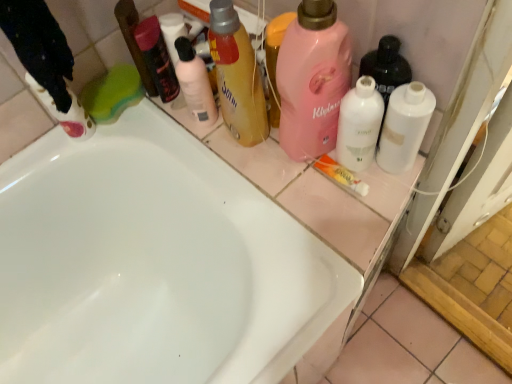
What is the approximate width of translucent yellow bottle at upper center, positioned as the fourth cleaning product in right-to-left order?

translucent yellow bottle at upper center, positioned as the fourth cleaning product in right-to-left order, is 2.25 inches in width.

Describe the element at coordinates (64, 113) in the screenshot. I see `matte white cleaning product at left, placed as the 7th cleaning product when sorted from right to left` at that location.

Where is `matte white cleaning product at left, placed as the 7th cleaning product when sorted from right to left`? The height and width of the screenshot is (384, 512). matte white cleaning product at left, placed as the 7th cleaning product when sorted from right to left is located at coordinates (64, 113).

Describe the element at coordinates (157, 58) in the screenshot. I see `matte black mouthwash at upper center` at that location.

I want to click on white glossy bathtub at center, so click(154, 264).

From the image's perspective, would you say white matte bottle at right, acting as the seventh cleaning product starting from the left, is positioned over matte pink bottle at upper center, which is counted as the third cleaning product, starting from the left?

No, from the image's perspective, white matte bottle at right, acting as the seventh cleaning product starting from the left, is not over matte pink bottle at upper center, which is counted as the third cleaning product, starting from the left.

In order to click on cleaning product that is the 5th one when counting downward from the matte pink bottle at upper center, which is the 5th cleaning product from right to left (from the image's perspective) in this screenshot , I will do `click(404, 126)`.

Is there a large distance between white matte bottle at right, which appears as the 1th cleaning product when viewed from the right, and matte pink bottle at upper center, which is counted as the third cleaning product, starting from the left?

No, white matte bottle at right, which appears as the 1th cleaning product when viewed from the right, is not far away from matte pink bottle at upper center, which is counted as the third cleaning product, starting from the left.

From the picture: Could you measure the distance between white matte bottle at right, acting as the seventh cleaning product starting from the left, and matte pink bottle at upper center, which is counted as the third cleaning product, starting from the left?

14.34 inches.

Can you see pink matte liquid at upper center, which is the third cleaning product in right-to-left order, touching green sponge at upper left, which is the 6th cleaning product from right to left?

No, pink matte liquid at upper center, which is the third cleaning product in right-to-left order, is not next to green sponge at upper left, which is the 6th cleaning product from right to left.

Considering the relative sizes of pink matte liquid at upper center, which is the third cleaning product in right-to-left order, and green sponge at upper left, which is the 6th cleaning product from right to left, in the image provided, is pink matte liquid at upper center, which is the third cleaning product in right-to-left order, bigger than green sponge at upper left, which is the 6th cleaning product from right to left,?

Yes.

Between pink matte liquid at upper center, which is the fifth cleaning product from left to right, and green sponge at upper left, which is the 6th cleaning product from right to left, which one has larger width?

pink matte liquid at upper center, which is the fifth cleaning product from left to right.

Is pink matte liquid at upper center, which is the fifth cleaning product from left to right, aimed at green sponge at upper left, which is the 6th cleaning product from right to left?

No, pink matte liquid at upper center, which is the fifth cleaning product from left to right, is not turned towards green sponge at upper left, which is the 6th cleaning product from right to left.

Consider the image. Considering their positions, is white glossy bathtub at center located in front of or behind translucent yellow bottle at upper center, positioned as the fourth cleaning product in right-to-left order?

white glossy bathtub at center is positioned closer to the viewer than translucent yellow bottle at upper center, positioned as the fourth cleaning product in right-to-left order.

From the image's perspective, between white glossy bathtub at center and translucent yellow bottle at upper center, the 4th cleaning product from the left, which one is located above?

translucent yellow bottle at upper center, the 4th cleaning product from the left, from the image's perspective.

Is translucent yellow bottle at upper center, the 4th cleaning product from the left, at the back of white glossy bathtub at center?

That's not correct — white glossy bathtub at center is not looking away from translucent yellow bottle at upper center, the 4th cleaning product from the left.

Which of these two, white glossy bathtub at center or translucent yellow bottle at upper center, the 4th cleaning product from the left, stands shorter?

With less height is translucent yellow bottle at upper center, the 4th cleaning product from the left.

From the image's perspective, is matte black mouthwash at upper center on white glossy toothpaste at center?

Correct, matte black mouthwash at upper center appears higher than white glossy toothpaste at center in the image.

Is matte black mouthwash at upper center facing towards white glossy toothpaste at center?

No, matte black mouthwash at upper center does not turn towards white glossy toothpaste at center.

Is matte black mouthwash at upper center not inside white glossy toothpaste at center?

matte black mouthwash at upper center lies outside white glossy toothpaste at center's area.

Does matte black mouthwash at upper center have a greater height compared to white glossy toothpaste at center?

Correct, matte black mouthwash at upper center is much taller as white glossy toothpaste at center.

Considering the relative sizes of white matte bottle at right, which appears as the 1th cleaning product when viewed from the right, and translucent yellow bottle at upper center, the 4th cleaning product from the left, in the image provided, is white matte bottle at right, which appears as the 1th cleaning product when viewed from the right, wider than translucent yellow bottle at upper center, the 4th cleaning product from the left,?

No.

Between white matte bottle at right, acting as the seventh cleaning product starting from the left, and translucent yellow bottle at upper center, the 4th cleaning product from the left, which one has more height?

translucent yellow bottle at upper center, the 4th cleaning product from the left, is taller.

What's the angular difference between white matte bottle at right, which appears as the 1th cleaning product when viewed from the right, and translucent yellow bottle at upper center, positioned as the fourth cleaning product in right-to-left order,'s facing directions?

9.93 degrees separate the facing orientations of white matte bottle at right, which appears as the 1th cleaning product when viewed from the right, and translucent yellow bottle at upper center, positioned as the fourth cleaning product in right-to-left order.

Are white matte bottle at right, acting as the seventh cleaning product starting from the left, and translucent yellow bottle at upper center, positioned as the fourth cleaning product in right-to-left order, far apart?

No, white matte bottle at right, acting as the seventh cleaning product starting from the left, is in close proximity to translucent yellow bottle at upper center, positioned as the fourth cleaning product in right-to-left order.

Does green sponge at upper left, which is the 6th cleaning product from right to left, have a larger size compared to white glossy bottle at center, which appears as the 6th cleaning product when viewed from the left?

Indeed, green sponge at upper left, which is the 6th cleaning product from right to left, has a larger size compared to white glossy bottle at center, which appears as the 6th cleaning product when viewed from the left.

Does green sponge at upper left, which appears as the second cleaning product when viewed from the left, appear on the left side of white glossy bottle at center, which appears as the second cleaning product when viewed from the right?

Correct, you'll find green sponge at upper left, which appears as the second cleaning product when viewed from the left, to the left of white glossy bottle at center, which appears as the second cleaning product when viewed from the right.

How much distance is there between green sponge at upper left, which appears as the second cleaning product when viewed from the left, and white glossy bottle at center, which appears as the 6th cleaning product when viewed from the left?

green sponge at upper left, which appears as the second cleaning product when viewed from the left, and white glossy bottle at center, which appears as the 6th cleaning product when viewed from the left, are 18.93 inches apart from each other.

Can you confirm if green sponge at upper left, which appears as the second cleaning product when viewed from the left, is thinner than white glossy bottle at center, which appears as the second cleaning product when viewed from the right?

In fact, green sponge at upper left, which appears as the second cleaning product when viewed from the left, might be wider than white glossy bottle at center, which appears as the second cleaning product when viewed from the right.

Does translucent yellow bottle at upper center, the 4th cleaning product from the left, have a lesser height compared to green sponge at upper left, which is the 6th cleaning product from right to left?

Incorrect, the height of translucent yellow bottle at upper center, the 4th cleaning product from the left, does not fall short of that of green sponge at upper left, which is the 6th cleaning product from right to left.

From a real-world perspective, which is physically above, translucent yellow bottle at upper center, positioned as the fourth cleaning product in right-to-left order, or green sponge at upper left, which is the 6th cleaning product from right to left?

translucent yellow bottle at upper center, positioned as the fourth cleaning product in right-to-left order, from a real-world perspective.

Would you say green sponge at upper left, which appears as the second cleaning product when viewed from the left, is part of translucent yellow bottle at upper center, positioned as the fourth cleaning product in right-to-left order,'s contents?

Actually, green sponge at upper left, which appears as the second cleaning product when viewed from the left, is outside translucent yellow bottle at upper center, positioned as the fourth cleaning product in right-to-left order.

Considering the relative sizes of translucent yellow bottle at upper center, the 4th cleaning product from the left, and green sponge at upper left, which appears as the second cleaning product when viewed from the left, in the image provided, is translucent yellow bottle at upper center, the 4th cleaning product from the left, bigger than green sponge at upper left, which appears as the second cleaning product when viewed from the left,?

Indeed, translucent yellow bottle at upper center, the 4th cleaning product from the left, has a larger size compared to green sponge at upper left, which appears as the second cleaning product when viewed from the left.

The image size is (512, 384). I want to click on the 4th cleaning product to the right when counting from the matte pink bottle at upper center, which is the 5th cleaning product from right to left, so click(404, 126).

Locate an element on the screen. the 6th cleaning product behind the pink matte liquid at upper center, which is the fifth cleaning product from left to right, starting your count from the anchor is located at coordinates point(112,93).

Looking at the image, which one is located closer to green sponge at upper left, which appears as the second cleaning product when viewed from the left, pink matte liquid at upper center, which is the fifth cleaning product from left to right, or matte white cleaning product at left, placed as the 7th cleaning product when sorted from right to left?

matte white cleaning product at left, placed as the 7th cleaning product when sorted from right to left.

Looking at the image, which one is located further to pink matte liquid at upper center, which is the fifth cleaning product from left to right, matte pink bottle at upper center, which is the 5th cleaning product from right to left, or white matte bottle at right, acting as the seventh cleaning product starting from the left?

Based on the image, matte pink bottle at upper center, which is the 5th cleaning product from right to left, appears to be further to pink matte liquid at upper center, which is the fifth cleaning product from left to right.

From the image, which object appears to be nearer to matte white cleaning product at left, placed as the 7th cleaning product when sorted from right to left, matte pink bottle at upper center, which is the 5th cleaning product from right to left, or pink matte liquid at upper center, which is the fifth cleaning product from left to right?

Based on the image, matte pink bottle at upper center, which is the 5th cleaning product from right to left, appears to be nearer to matte white cleaning product at left, placed as the 7th cleaning product when sorted from right to left.

Looking at the image, which one is located further to matte pink bottle at upper center, which is counted as the third cleaning product, starting from the left, green sponge at upper left, which appears as the second cleaning product when viewed from the left, or white glossy bathtub at center?

white glossy bathtub at center lies further to matte pink bottle at upper center, which is counted as the third cleaning product, starting from the left, than the other object.

Considering their positions, is translucent yellow bottle at upper center, the 4th cleaning product from the left, positioned closer to matte black mouthwash at upper center than matte white cleaning product at left, placed as the 1th cleaning product when sorted from left to right?

The object closer to matte black mouthwash at upper center is translucent yellow bottle at upper center, the 4th cleaning product from the left.

Considering their positions, is matte black mouthwash at upper center positioned further to matte pink bottle at upper center, which is counted as the third cleaning product, starting from the left, than matte white cleaning product at left, placed as the 7th cleaning product when sorted from right to left?

Based on the image, matte white cleaning product at left, placed as the 7th cleaning product when sorted from right to left, appears to be further to matte pink bottle at upper center, which is counted as the third cleaning product, starting from the left.

Based on their spatial positions, is white matte bottle at right, acting as the seventh cleaning product starting from the left, or white glossy bottle at center, which appears as the second cleaning product when viewed from the right, closer to translucent yellow bottle at upper center, the 4th cleaning product from the left?

Based on the image, white glossy bottle at center, which appears as the second cleaning product when viewed from the right, appears to be nearer to translucent yellow bottle at upper center, the 4th cleaning product from the left.

Consider the image. Considering their positions, is white glossy bathtub at center positioned closer to pink matte liquid at upper center, which is the third cleaning product in right-to-left order, than white glossy toothpaste at center?

Based on the image, white glossy toothpaste at center appears to be nearer to pink matte liquid at upper center, which is the third cleaning product in right-to-left order.

Identify the location of bathtub between matte white cleaning product at left, placed as the 7th cleaning product when sorted from right to left, and white matte bottle at right, acting as the seventh cleaning product starting from the left. The image size is (512, 384). (154, 264).

Where is `toothpaste situated between green sponge at upper left, which appears as the second cleaning product when viewed from the left, and white matte bottle at right, acting as the seventh cleaning product starting from the left, from left to right`? This screenshot has height=384, width=512. toothpaste situated between green sponge at upper left, which appears as the second cleaning product when viewed from the left, and white matte bottle at right, acting as the seventh cleaning product starting from the left, from left to right is located at coordinates (341, 175).

Find the location of a particular element. The image size is (512, 384). cleaning product situated between green sponge at upper left, which appears as the second cleaning product when viewed from the left, and translucent yellow bottle at upper center, positioned as the fourth cleaning product in right-to-left order, from left to right is located at coordinates (195, 83).

The height and width of the screenshot is (384, 512). What are the coordinates of `mouthwash situated between matte white cleaning product at left, placed as the 1th cleaning product when sorted from left to right, and translucent yellow bottle at upper center, the 4th cleaning product from the left, from left to right` in the screenshot? It's located at (157, 58).